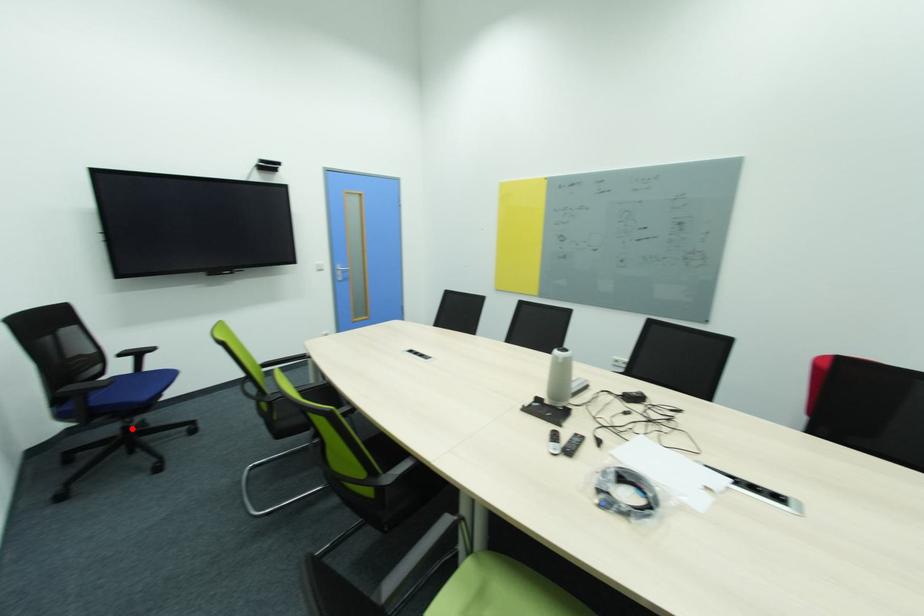
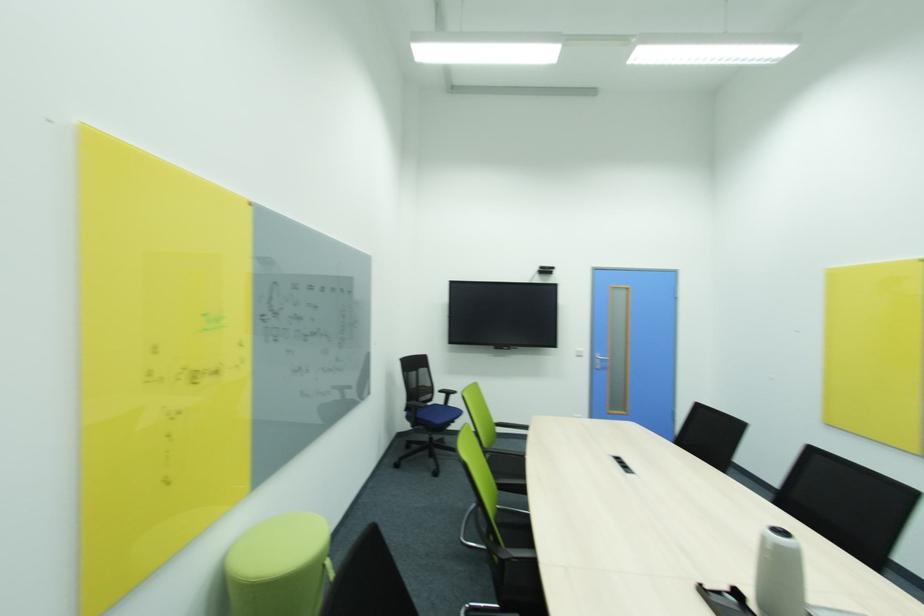
Question: I am providing you with two images of the same scene from different viewpoints. Given a red point in image1, look at the same physical point in image2. Is it:

Choices:
 (A) Closer to the viewpoint
 (B) Farther from the viewpoint

Answer: (B)